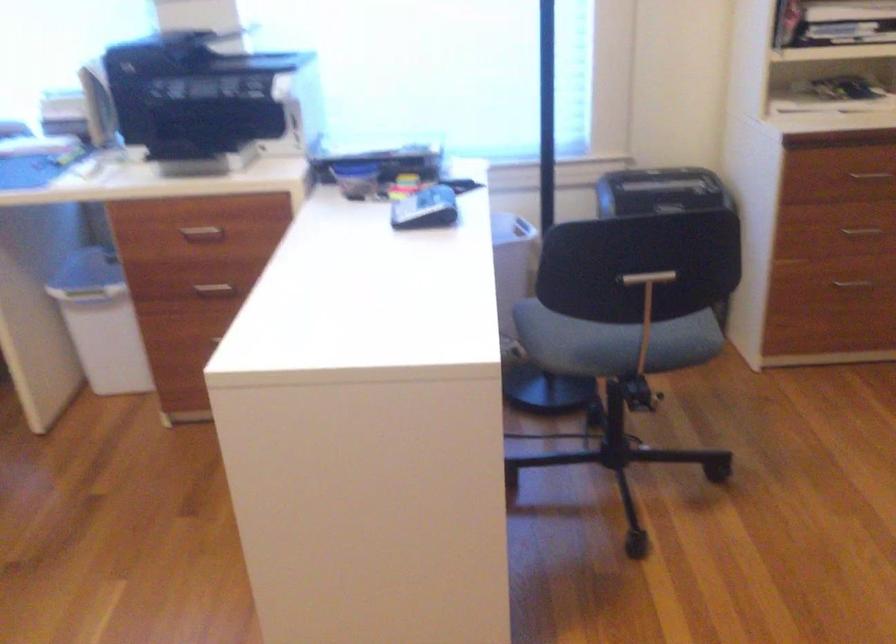
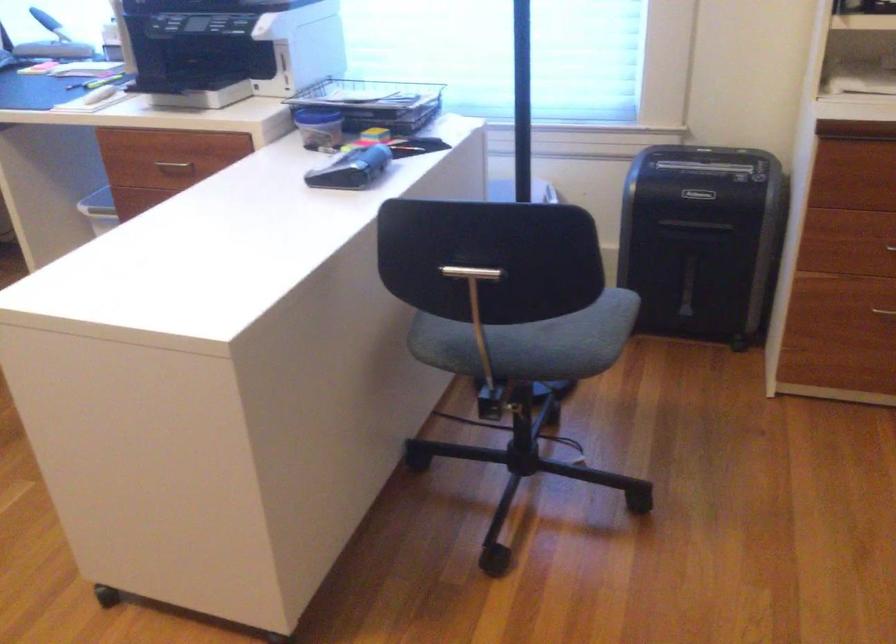
Find the pixel in the second image that matches [642,341] in the first image.

(531, 342)